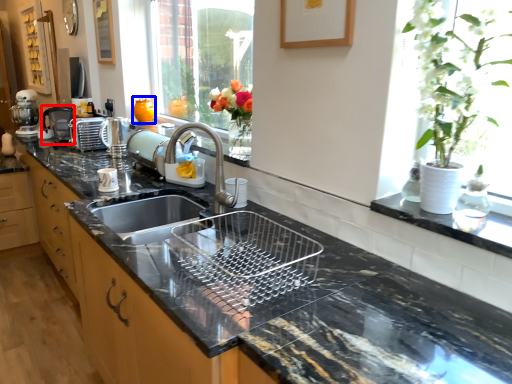
Question: Which of the following is the closest to the observer, coffee machine (highlighted by a red box) or vase (highlighted by a blue box)?

Choices:
 (A) coffee machine
 (B) vase

Answer: (B)